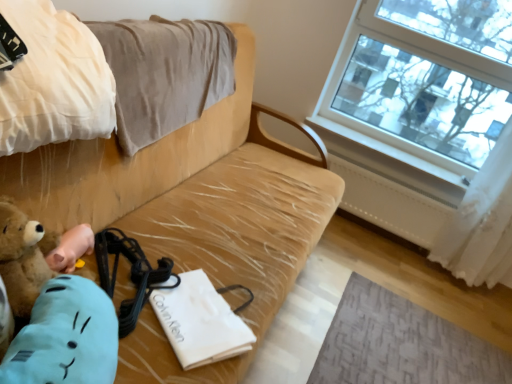
What do you see at coordinates (407, 93) in the screenshot?
I see `transparent glass window at upper right` at bounding box center [407, 93].

This screenshot has height=384, width=512. What do you see at coordinates (387, 150) in the screenshot?
I see `white painted wood at upper right` at bounding box center [387, 150].

Identify the location of textured gray mat at lower right. (401, 344).

Identify the location of brown plush toy at lower left. Image resolution: width=512 pixels, height=384 pixels. (71, 249).

From the picture: Which of these two, beige cotton blanket at upper left, placed as the first blanket when sorted from front to back, or white paper bag at center, is thinner?

With smaller width is white paper bag at center.

Are beige cotton blanket at upper left, the second blanket when ordered from back to front, and white paper bag at center beside each other?

There is a gap between beige cotton blanket at upper left, the second blanket when ordered from back to front, and white paper bag at center.

From the image's perspective, which is above, beige cotton blanket at upper left, the second blanket when ordered from back to front, or white paper bag at center?

beige cotton blanket at upper left, the second blanket when ordered from back to front, appears higher in the image.

Measure the distance from beige cotton blanket at upper left, placed as the first blanket when sorted from front to back, to white paper bag at center.

beige cotton blanket at upper left, placed as the first blanket when sorted from front to back, is 22.71 inches from white paper bag at center.

Would you say beige cotton blanket at upper left, the 2th blanket when ordered from front to back, is to the left or to the right of beige fabric couch at center in the picture?

beige cotton blanket at upper left, the 2th blanket when ordered from front to back, is to the left of beige fabric couch at center.

Looking at their sizes, would you say beige cotton blanket at upper left, the first blanket in the back-to-front sequence, is wider or thinner than beige fabric couch at center?

Considering their sizes, beige cotton blanket at upper left, the first blanket in the back-to-front sequence, looks slimmer than beige fabric couch at center.

Which of these two, beige cotton blanket at upper left, the first blanket in the back-to-front sequence, or beige fabric couch at center, is bigger?

beige fabric couch at center is bigger.

From the image's perspective, would you say beige cotton blanket at upper left, the 2th blanket when ordered from front to back, is shown under beige fabric couch at center?

Actually, beige cotton blanket at upper left, the 2th blanket when ordered from front to back, appears above beige fabric couch at center in the image.

Is there a large distance between white sheer curtain at right and beige cotton blanket at upper left, placed as the first blanket when sorted from front to back?

white sheer curtain at right is far away from beige cotton blanket at upper left, placed as the first blanket when sorted from front to back.

Does white sheer curtain at right have a lesser height compared to beige cotton blanket at upper left, the second blanket when ordered from back to front?

In fact, white sheer curtain at right may be taller than beige cotton blanket at upper left, the second blanket when ordered from back to front.

From a real-world perspective, starting from the white sheer curtain at right, which blanket is the 2nd one vertically above it? Please provide its 2D coordinates.

[(53, 81)]

Is point (511, 148) closer to viewer compared to point (57, 15)?

That is False.

Considering the relative sizes of textured gray mat at lower right and white sheer curtain at right in the image provided, is textured gray mat at lower right bigger than white sheer curtain at right?

Incorrect, textured gray mat at lower right is not larger than white sheer curtain at right.

Does textured gray mat at lower right have a greater height compared to white sheer curtain at right?

Incorrect, the height of textured gray mat at lower right is not larger of that of white sheer curtain at right.

Is white sheer curtain at right surrounded by textured gray mat at lower right?

No, white sheer curtain at right is not inside textured gray mat at lower right.

Would you say textured gray mat at lower right is a long distance from white sheer curtain at right?

No, there isn't a large distance between textured gray mat at lower right and white sheer curtain at right.

Considering the positions of objects white painted wood at upper right and beige cotton blanket at upper left, the first blanket in the back-to-front sequence, in the image provided, who is more to the left, white painted wood at upper right or beige cotton blanket at upper left, the first blanket in the back-to-front sequence,?

beige cotton blanket at upper left, the first blanket in the back-to-front sequence.

Find the location of a particular element. This screenshot has width=512, height=384. window sill behind the beige cotton blanket at upper left, the 2th blanket when ordered from front to back is located at coordinates (387, 150).

Is white painted wood at upper right closer to camera compared to beige cotton blanket at upper left, the first blanket in the back-to-front sequence?

That is False.

Which is in front, point (445, 177) or point (203, 48)?

Point (203, 48)

Is textured gray mat at lower right further to the viewer compared to beige cotton blanket at upper left, the first blanket in the back-to-front sequence?

Yes, textured gray mat at lower right is further from the viewer.

Does textured gray mat at lower right appear on the right side of beige cotton blanket at upper left, the 2th blanket when ordered from front to back?

Yes.

From a real-world perspective, is textured gray mat at lower right physically located above or below beige cotton blanket at upper left, the 2th blanket when ordered from front to back?

textured gray mat at lower right is situated lower than beige cotton blanket at upper left, the 2th blanket when ordered from front to back, in the real world.

Which is behind, point (382, 360) or point (135, 107)?

The point (382, 360) is more distant.

How much distance is there between textured gray mat at lower right and white paper bag at center?

textured gray mat at lower right is 37.61 inches away from white paper bag at center.

Can white paper bag at center be found inside textured gray mat at lower right?

Actually, white paper bag at center is outside textured gray mat at lower right.

In terms of height, does textured gray mat at lower right look taller or shorter compared to white paper bag at center?

textured gray mat at lower right is shorter than white paper bag at center.

Can you confirm if textured gray mat at lower right is bigger than white paper bag at center?

Indeed, textured gray mat at lower right has a larger size compared to white paper bag at center.

At what (x,y) coordinates should I click in order to perform the action: click on journal directly beneath the beige cotton blanket at upper left, placed as the first blanket when sorted from front to back (from a real-world perspective). Please return your answer as a coordinate pair (x, y). The width and height of the screenshot is (512, 384). Looking at the image, I should click on (200, 322).

From the beige fabric couch at center, count 2nd blankets backward and point to it. Please provide its 2D coordinates.

[(164, 73)]

Which object lies nearer to the anchor point white sheer curtain at right, white painted wood at upper right or brown plush toy at lower left?

Based on the image, white painted wood at upper right appears to be nearer to white sheer curtain at right.

Based on their spatial positions, is beige fabric couch at center or transparent glass window at upper right further from beige cotton blanket at upper left, placed as the first blanket when sorted from front to back?

transparent glass window at upper right.

Looking at this image, considering their positions, is brown plush toy at lower left positioned closer to white paper bag at center than white painted wood at upper right?

Based on the image, brown plush toy at lower left appears to be nearer to white paper bag at center.

Consider the image. Which object lies further to the anchor point white paper bag at center, white sheer curtain at right or beige fabric couch at center?

white sheer curtain at right is further to white paper bag at center.

Estimate the real-world distances between objects in this image. Which object is closer to brown plush toy at lower left, beige cotton blanket at upper left, placed as the first blanket when sorted from front to back, or beige fabric couch at center?

beige cotton blanket at upper left, placed as the first blanket when sorted from front to back, is positioned closer to the anchor brown plush toy at lower left.

When comparing their distances from brown plush toy at lower left, does beige cotton blanket at upper left, placed as the first blanket when sorted from front to back, or beige cotton blanket at upper left, the first blanket in the back-to-front sequence, seem further?

beige cotton blanket at upper left, the first blanket in the back-to-front sequence.

Looking at the image, which one is located closer to beige fabric couch at center, white painted wood at upper right or beige cotton blanket at upper left, the first blanket in the back-to-front sequence?

beige cotton blanket at upper left, the first blanket in the back-to-front sequence, is closer to beige fabric couch at center.

Estimate the real-world distances between objects in this image. Which object is further from beige fabric couch at center, white paper bag at center or beige cotton blanket at upper left, the 2th blanket when ordered from front to back?

white paper bag at center is further to beige fabric couch at center.

The image size is (512, 384). In order to click on window sill between brown plush toy at lower left and white sheer curtain at right from left to right in this screenshot , I will do coord(387,150).

At what (x,y) coordinates should I click in order to perform the action: click on journal located between beige fabric couch at center and beige cotton blanket at upper left, the first blanket in the back-to-front sequence, in the depth direction. Please return your answer as a coordinate pair (x, y). Looking at the image, I should click on (200, 322).

Where is `blanket between brown plush toy at lower left and white painted wood at upper right from front to back`? This screenshot has width=512, height=384. blanket between brown plush toy at lower left and white painted wood at upper right from front to back is located at coordinates (164, 73).

Find the location of `blanket between beige fabric couch at center and white paper bag at center in the front-back direction`. blanket between beige fabric couch at center and white paper bag at center in the front-back direction is located at coordinates (53, 81).